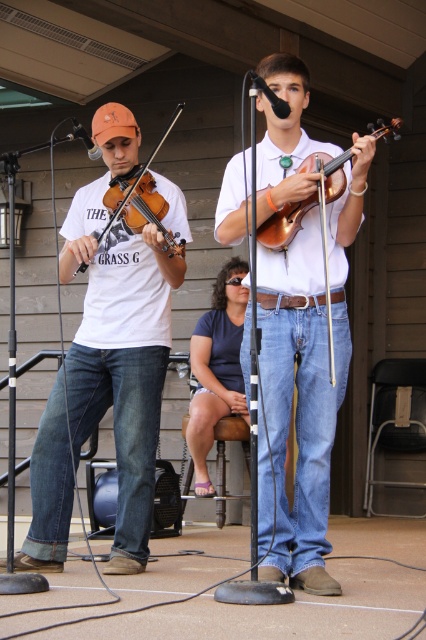
You are a photographer trying to capture a closeup shot of the wooden violin at center and the matte brown violin at left. Since you want to focus on the violins, you need to ensure they are both in frame. Given their positions, which violin should you position first in your camera viewfinder to ensure both are visible?

The wooden violin at center is to the right of the matte brown violin at left. To ensure both are visible, position the matte brown violin at left first in your camera viewfinder since it is on the left side, allowing space for the wooden violin at center to the right.

Based on the scene description, where is the wooden violin at center located in terms of coordinates?

The wooden violin at center is located at point (284, 224).